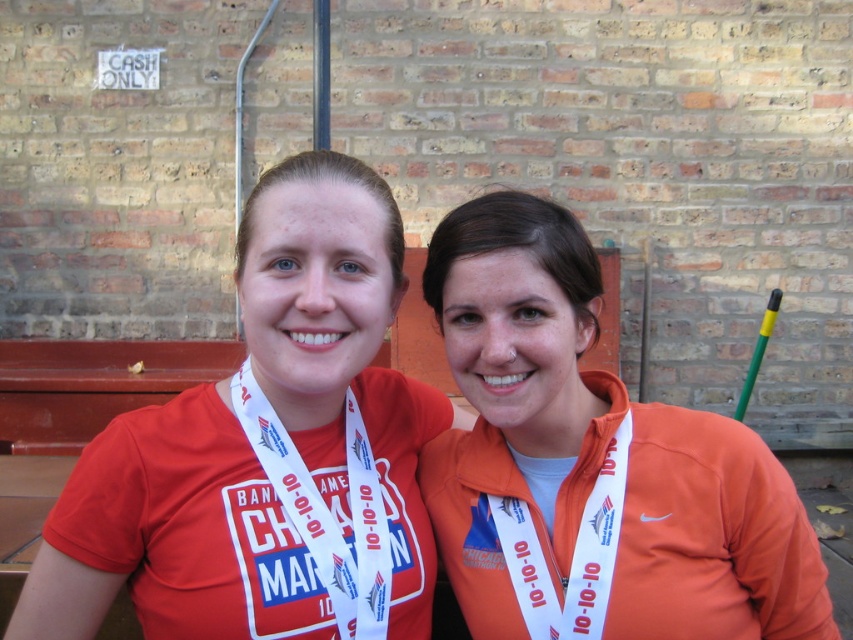
Question: Is matte red shirt at center thinner than orange fleece jacket at center?

Choices:
 (A) no
 (B) yes

Answer: (A)

Question: Which of the following is the closest to the observer?

Choices:
 (A) matte white medal at center
 (B) matte red shirt at center
 (C) orange fleece jacket at center
 (D) white fabric lanyard at left

Answer: (B)

Question: Considering the relative positions of matte red shirt at center and orange fabric at center in the image provided, where is matte red shirt at center located with respect to orange fabric at center?

Choices:
 (A) below
 (B) above

Answer: (A)

Question: Which is farther from the orange fleece jacket at center?

Choices:
 (A) matte red shirt at center
 (B) matte white medal at center

Answer: (B)

Question: Which point is closer to the camera?

Choices:
 (A) (695, 538)
 (B) (369, 497)

Answer: (A)

Question: Is orange fabric at center to the left of matte white medal at center from the viewer's perspective?

Choices:
 (A) no
 (B) yes

Answer: (A)